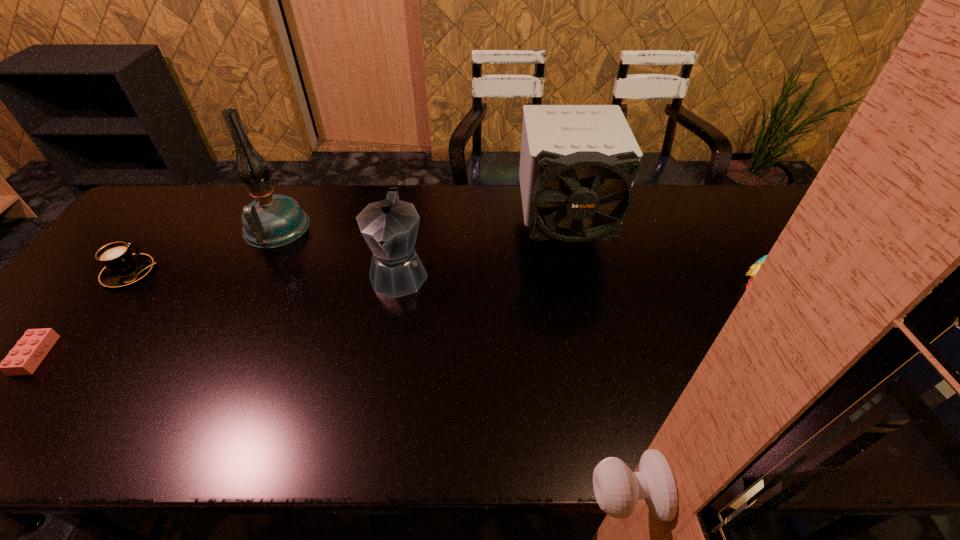
In order to click on vacant space located 0.070m on the back of the cappuccino in this screenshot , I will do `click(155, 240)`.

Identify the location of vacant position located on the back of the shortest object. This screenshot has width=960, height=540. click(95, 283).

What are the coordinates of `oil lamp at the far edge` in the screenshot? It's located at pos(272,220).

This screenshot has height=540, width=960. What are the coordinates of `fan that is positioned at the far edge` in the screenshot? It's located at (578, 163).

Find the location of `cappuccino that is at the left edge`. cappuccino that is at the left edge is located at coordinates pos(122,268).

This screenshot has width=960, height=540. I want to click on Lego at the left edge, so [x=28, y=353].

Identify the location of object that is at the right edge. The image size is (960, 540). (754, 268).

Identify the location of free space at the far edge of the desktop. Image resolution: width=960 pixels, height=540 pixels. (443, 217).

The width and height of the screenshot is (960, 540). In the image, there is a desktop. What are the coordinates of `vacant space at the near edge` in the screenshot? It's located at (102, 441).

Locate an element on the screen. The height and width of the screenshot is (540, 960). vacant area at the left edge of the desktop is located at coordinates (72, 297).